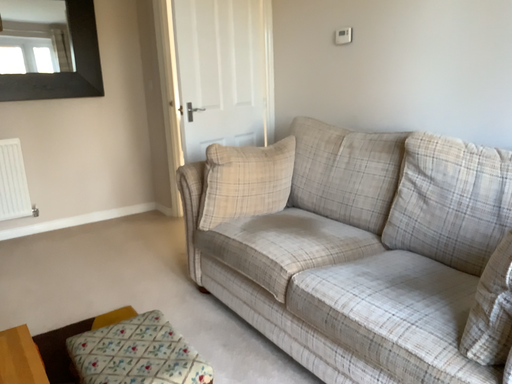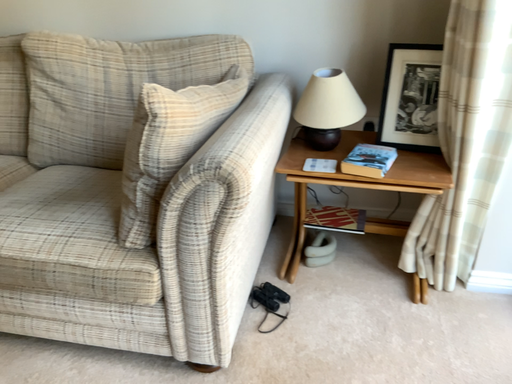
Question: Which way did the camera rotate in the video?

Choices:
 (A) rotated left
 (B) rotated right

Answer: (B)